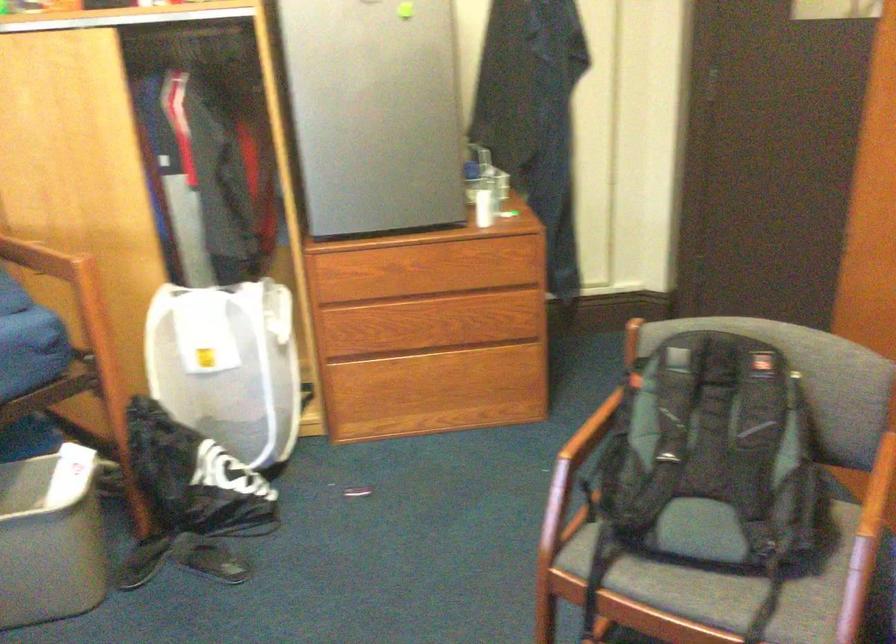
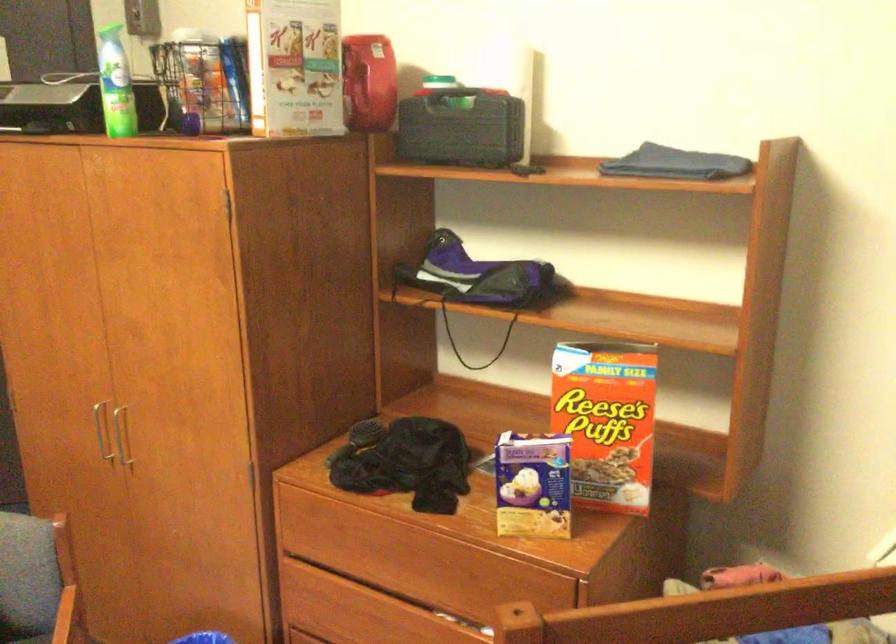
Question: The camera is either moving clockwise (left) or counter-clockwise (right) around the object. The first image is from the beginning of the video and the second image is from the end. Is the camera moving left or right when shooting the video?

Choices:
 (A) Left
 (B) Right

Answer: (A)